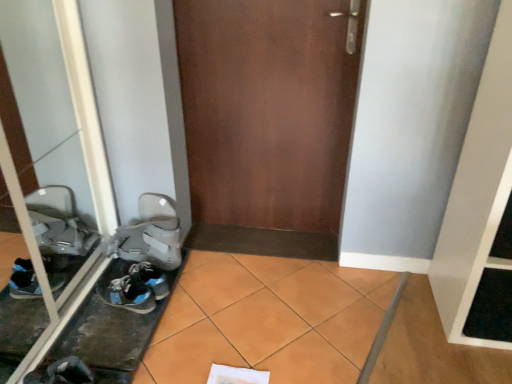
Question: In terms of size, does brown matte door at center appear bigger or smaller than transparent glass door at left?

Choices:
 (A) small
 (B) big

Answer: (B)

Question: In the image, is brown matte door at center positioned in front of or behind transparent glass door at left?

Choices:
 (A) behind
 (B) front

Answer: (A)

Question: Which is nearer to the gray fabric sneaker at lower left, which is the first footwear from back to front?

Choices:
 (A) brown matte door at center
 (B) transparent glass door at left
 (C) blue synthetic sneakers at lower left, which ranks as the second footwear in bottom-to-top order
 (D) dark gray fabric sneaker at lower left, the 1th footwear from the bottom

Answer: (C)

Question: Which object is positioned farthest from the blue synthetic sneakers at lower left, which is the 2th footwear in front-to-back order?

Choices:
 (A) gray fabric sneaker at lower left, which is the 1th footwear from top to bottom
 (B) dark gray fabric sneaker at lower left, marked as the 3th footwear in a top-to-bottom arrangement
 (C) transparent glass door at left
 (D) brown matte door at center

Answer: (D)